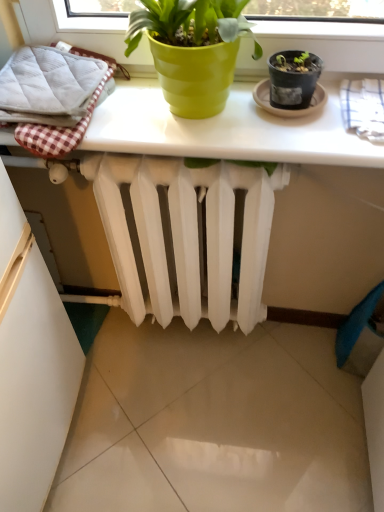
This screenshot has height=512, width=384. Identify the location of vacant area on top of white matte radiator at center (from a real-world perspective). (190, 164).